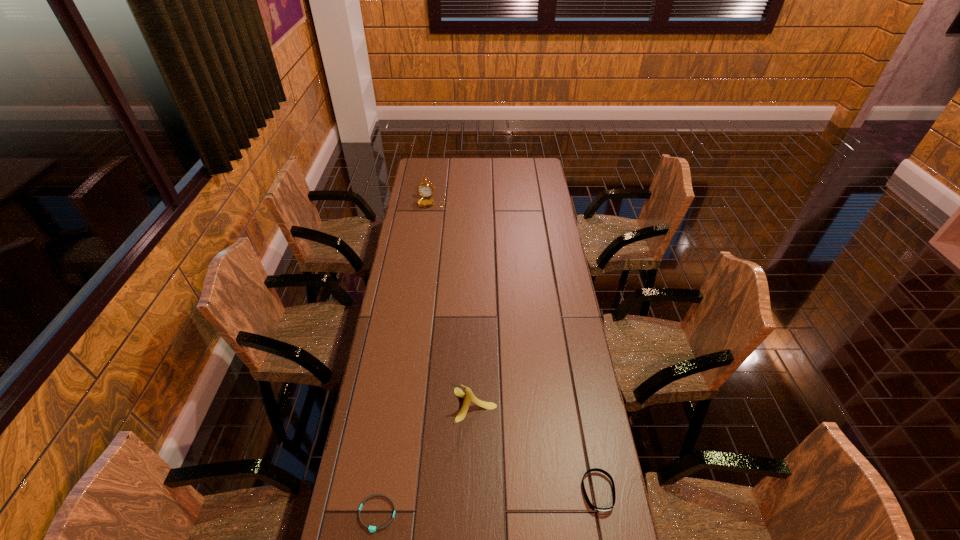
Identify the location of free space between the right wristband and the second object from right to left. (537, 449).

Locate an element on the screen. free space that is in between the pocket watch and the third tallest object is located at coordinates (515, 347).

Locate an element on the screen. This screenshot has height=540, width=960. free space between the right wristband and the third nearest object is located at coordinates (537, 449).

Where is `unoccupied area between the pocket watch and the left wristband`? Image resolution: width=960 pixels, height=540 pixels. unoccupied area between the pocket watch and the left wristband is located at coordinates (404, 358).

Find the location of a particular element. unoccupied area between the second object from right to left and the farthest object is located at coordinates (453, 303).

Locate which object is the third closest to the left wristband. Please provide its 2D coordinates. Your answer should be formatted as a tuple, i.e. [(x, y)], where the tuple contains the x and y coordinates of a point satisfying the conditions above.

[(426, 190)]

Point out which object is positioned as the third nearest to the rightmost object. Please provide its 2D coordinates. Your answer should be formatted as a tuple, i.e. [(x, y)], where the tuple contains the x and y coordinates of a point satisfying the conditions above.

[(426, 190)]

The image size is (960, 540). In order to click on vacant space that satisfies the following two spatial constraints: 1. on the face of the banana; 2. on the right side of the pocket watch in this screenshot , I will do `click(403, 405)`.